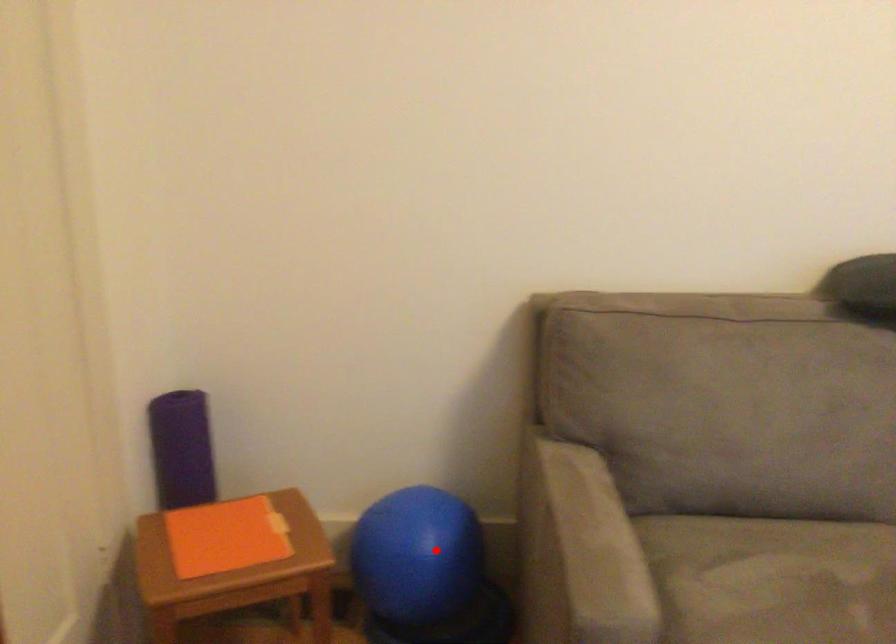
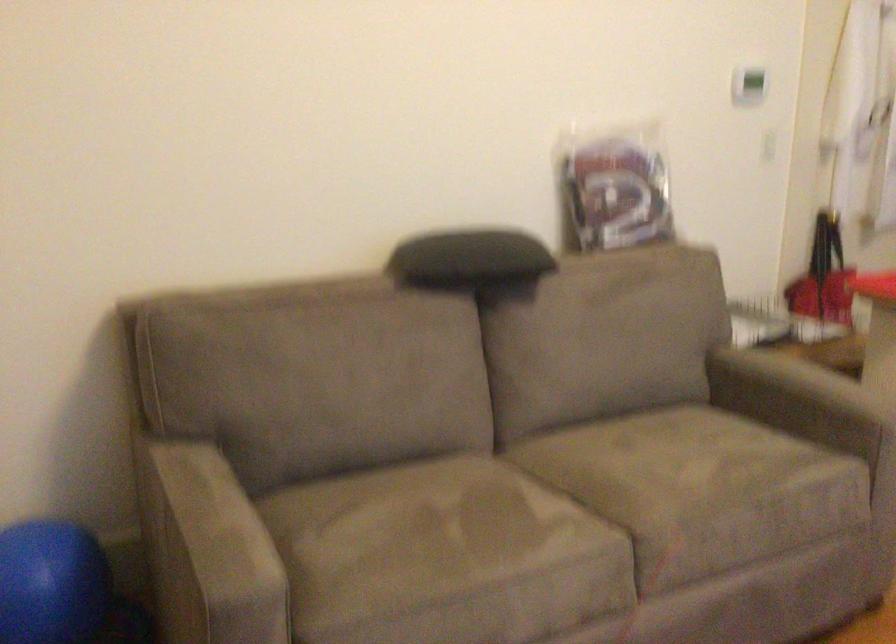
The point at the highlighted location is marked in the first image. Where is the corresponding point in the second image?

(49, 583)